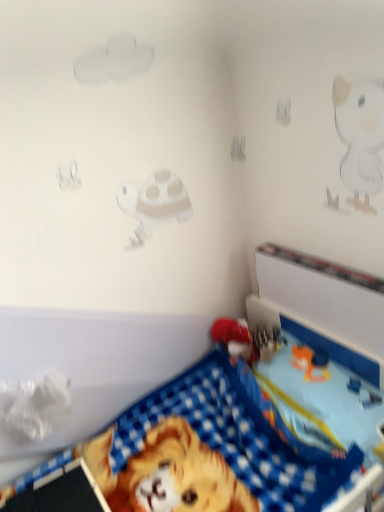
Question: Is matte red toy at center, the first toy positioned from the right, to the right of blue fabric blanket at lower right, which is counted as the first toy, starting from the left, from the viewer's perspective?

Choices:
 (A) no
 (B) yes

Answer: (B)

Question: Is matte red toy at center, the 2th toy in the left-to-right sequence, bigger than blue fabric blanket at lower right, which is counted as the first toy, starting from the left?

Choices:
 (A) yes
 (B) no

Answer: (B)

Question: From a real-world perspective, is matte red toy at center, the 2th toy in the left-to-right sequence, over blue fabric blanket at lower right, which is counted as the first toy, starting from the left?

Choices:
 (A) no
 (B) yes

Answer: (B)

Question: Is matte red toy at center, the 2th toy in the left-to-right sequence, further to camera compared to blue fabric blanket at lower right, which is the 2th toy in right-to-left order?

Choices:
 (A) no
 (B) yes

Answer: (B)

Question: Can blue fabric blanket at lower right, which is the 2th toy in right-to-left order, be found inside matte red toy at center, the first toy positioned from the right?

Choices:
 (A) no
 (B) yes

Answer: (A)

Question: From the image's perspective, does matte red toy at center, the first toy positioned from the right, appear lower than blue fabric blanket at lower right, which is counted as the first toy, starting from the left?

Choices:
 (A) yes
 (B) no

Answer: (B)

Question: Can you confirm if blue fabric blanket at lower right, which is the 2th toy in right-to-left order, is smaller than matte red toy at center, the first toy positioned from the right?

Choices:
 (A) no
 (B) yes

Answer: (A)

Question: Considering the relative sizes of blue fabric blanket at lower right, which is counted as the first toy, starting from the left, and matte red toy at center, the 2th toy in the left-to-right sequence, in the image provided, is blue fabric blanket at lower right, which is counted as the first toy, starting from the left, taller than matte red toy at center, the 2th toy in the left-to-right sequence,?

Choices:
 (A) yes
 (B) no

Answer: (A)

Question: From a real-world perspective, is blue fabric blanket at lower right, which is counted as the first toy, starting from the left, on matte red toy at center, the 2th toy in the left-to-right sequence?

Choices:
 (A) no
 (B) yes

Answer: (A)

Question: Is blue fabric blanket at lower right, which is counted as the first toy, starting from the left, not inside matte red toy at center, the 2th toy in the left-to-right sequence?

Choices:
 (A) no
 (B) yes

Answer: (B)

Question: From the image's perspective, is blue fabric blanket at lower right, which is the 2th toy in right-to-left order, above matte red toy at center, the first toy positioned from the right?

Choices:
 (A) yes
 (B) no

Answer: (B)

Question: Does blue fabric blanket at lower right, which is counted as the first toy, starting from the left, have a larger size compared to matte red toy at center, the 2th toy in the left-to-right sequence?

Choices:
 (A) no
 (B) yes

Answer: (B)

Question: In terms of size, does blue fabric blanket at lower right, which is the 2th toy in right-to-left order, appear bigger or smaller than matte red toy at center, the first toy positioned from the right?

Choices:
 (A) big
 (B) small

Answer: (A)